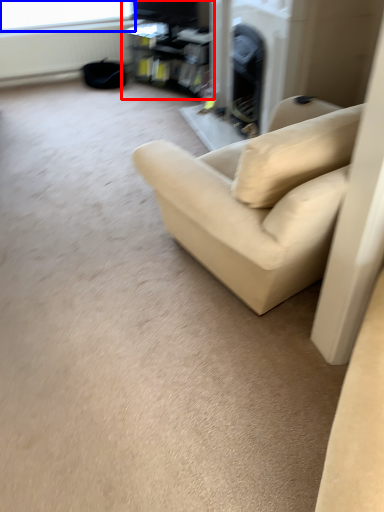
Question: Which of the following is the farthest to the observer, entertainment center (highlighted by a red box) or window screen (highlighted by a blue box)?

Choices:
 (A) entertainment center
 (B) window screen

Answer: (B)